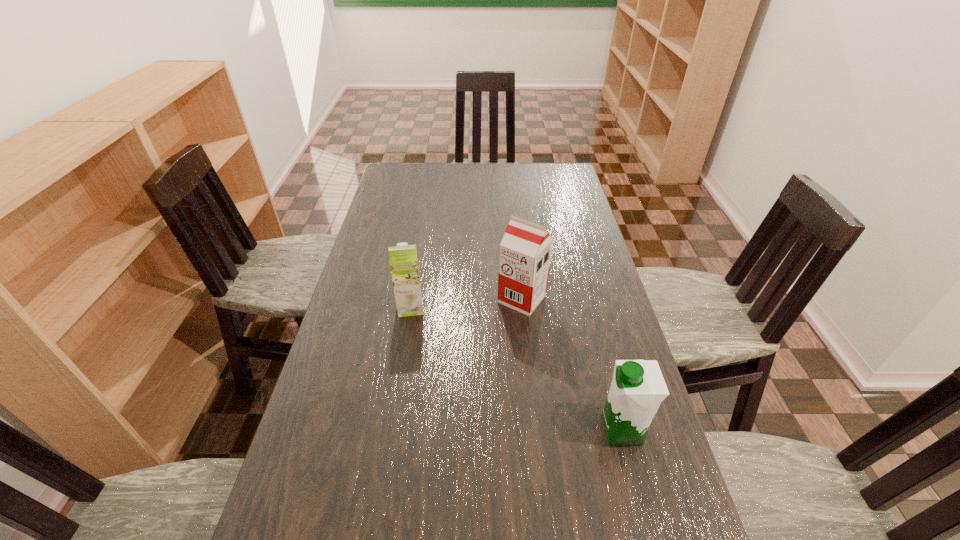
Where is `object present at the left edge`? object present at the left edge is located at coordinates (403, 260).

This screenshot has height=540, width=960. Identify the location of object that is at the right edge. (638, 387).

In the image, there is a desktop. Find the location of `vacant space at the far edge`. vacant space at the far edge is located at coordinates (531, 167).

Identify the location of vacant position at the left edge of the desktop. (368, 235).

The image size is (960, 540). Identify the location of free space at the right edge of the desktop. (580, 308).

The height and width of the screenshot is (540, 960). In order to click on free area in between the nearest soya milk and the leftmost object in this screenshot , I will do `click(516, 368)`.

At what (x,y) coordinates should I click in order to perform the action: click on free point between the leftmost object and the rightmost soya milk. Please return your answer as a coordinate pair (x, y). The width and height of the screenshot is (960, 540). Looking at the image, I should click on (516, 368).

Identify the location of free space between the rightmost object and the leftmost object. The height and width of the screenshot is (540, 960). (516, 368).

Where is `free space between the second soya milk from right to left and the rightmost object`? Image resolution: width=960 pixels, height=540 pixels. free space between the second soya milk from right to left and the rightmost object is located at coordinates (572, 364).

Locate an element on the screen. This screenshot has height=540, width=960. free space between the tallest soya milk and the nearest object is located at coordinates (572, 364).